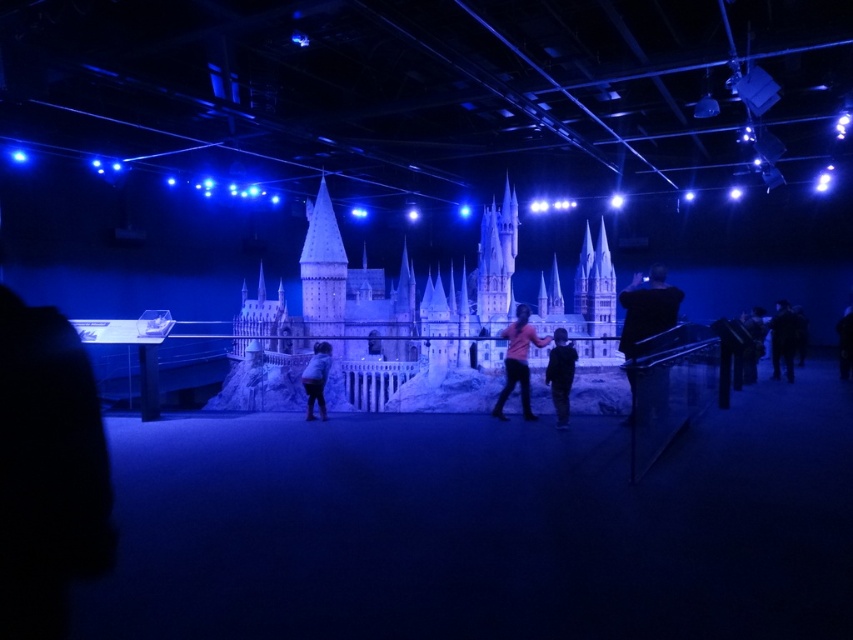
Question: Based on their relative distances, which object is farther from the dark clothing figure at right?

Choices:
 (A) dark blue fabric jacket at center
 (B) pink matte shirt at center
 (C) dark blue fabric jacket at right

Answer: (B)

Question: Which object is positioned closest to the pink matte shirt at center?

Choices:
 (A) matte plastic castle at center
 (B) white fabric bag at center
 (C) dark blue fabric jacket at center
 (D) dark blue fabric jacket at right

Answer: (C)

Question: Does dark blue fabric jacket at center have a greater width compared to white fabric bag at center?

Choices:
 (A) no
 (B) yes

Answer: (B)

Question: Does pink matte shirt at center appear under dark clothing figure at right?

Choices:
 (A) yes
 (B) no

Answer: (A)

Question: From the image, what is the correct spatial relationship of black matte jacket at right in relation to white fabric bag at center?

Choices:
 (A) right
 (B) left

Answer: (A)

Question: Which object appears farthest from the camera in this image?

Choices:
 (A) white fabric bag at center
 (B) matte plastic castle at center
 (C) black matte jacket at right

Answer: (B)